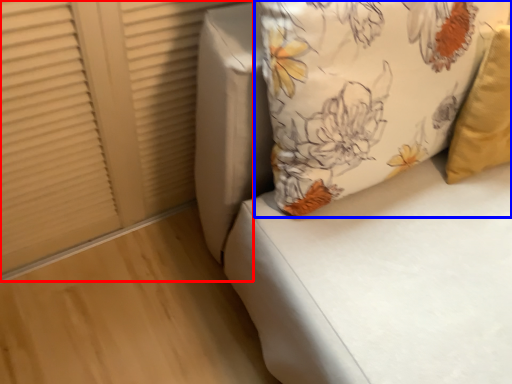
Question: Which object is closer to the camera taking this photo, shutter (highlighted by a red box) or pillow (highlighted by a blue box)?

Choices:
 (A) shutter
 (B) pillow

Answer: (B)